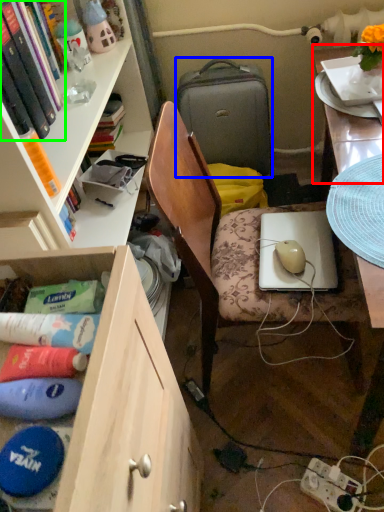
Question: Which is farther away from table top (highlighted by a red box)? suitcase (highlighted by a blue box) or book (highlighted by a green box)?

Choices:
 (A) suitcase
 (B) book

Answer: (B)